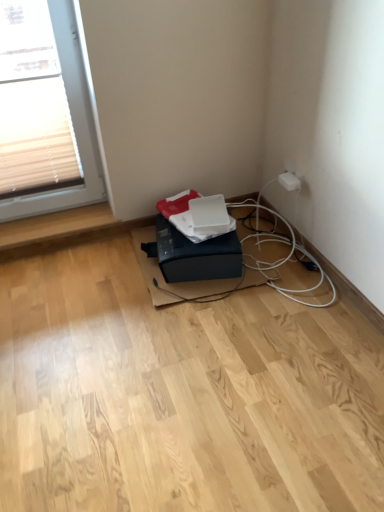
This screenshot has width=384, height=512. Describe the element at coordinates (289, 181) in the screenshot. I see `white plastic electric outlet at upper right` at that location.

Locate an element on the screen. white plastic electric outlet at upper right is located at coordinates (289, 181).

Locate an element on the screen. The width and height of the screenshot is (384, 512). black matte printer at lower center is located at coordinates (196, 255).

Image resolution: width=384 pixels, height=512 pixels. What do you see at coordinates (196, 255) in the screenshot?
I see `black matte printer at lower center` at bounding box center [196, 255].

Locate an element on the screen. The image size is (384, 512). white plastic electric outlet at upper right is located at coordinates (289, 181).

Would you say black matte printer at lower center is to the left or to the right of white plastic electric outlet at upper right in the picture?

Clearly, black matte printer at lower center is on the left of white plastic electric outlet at upper right in the image.

Which is in front, black matte printer at lower center or white plastic electric outlet at upper right?

black matte printer at lower center is more forward.

Which is nearer, (189, 274) or (278, 181)?

Point (189, 274) is closer to the camera than point (278, 181).

From the image's perspective, is black matte printer at lower center on top of white plastic electric outlet at upper right?

Incorrect, from the image's perspective, black matte printer at lower center is lower than white plastic electric outlet at upper right.

From a real-world perspective, is black matte printer at lower center on white plastic electric outlet at upper right?

No.

Does black matte printer at lower center have a lesser width compared to white plastic electric outlet at upper right?

No.

From their relative heights in the image, would you say black matte printer at lower center is taller or shorter than white plastic electric outlet at upper right?

In the image, black matte printer at lower center appears to be taller than white plastic electric outlet at upper right.

Does black matte printer at lower center have a larger size compared to white plastic electric outlet at upper right?

Yes, black matte printer at lower center is bigger than white plastic electric outlet at upper right.

Does black matte printer at lower center contain white plastic electric outlet at upper right?

That's incorrect, white plastic electric outlet at upper right is not inside black matte printer at lower center.

Is black matte printer at lower center not near white plastic electric outlet at upper right?

No, black matte printer at lower center is in close proximity to white plastic electric outlet at upper right.

Does black matte printer at lower center turn towards white plastic electric outlet at upper right?

No, black matte printer at lower center does not turn towards white plastic electric outlet at upper right.

What's the angular difference between black matte printer at lower center and white plastic electric outlet at upper right's facing directions?

There is a 15.6-degree angle between the facing directions of black matte printer at lower center and white plastic electric outlet at upper right.

How much distance is there between black matte printer at lower center and white plastic electric outlet at upper right?

A distance of 21.75 inches exists between black matte printer at lower center and white plastic electric outlet at upper right.

Where is `electric outlet behind the black matte printer at lower center`? The width and height of the screenshot is (384, 512). electric outlet behind the black matte printer at lower center is located at coordinates (289, 181).

Can you confirm if white plastic electric outlet at upper right is positioned to the right of black matte printer at lower center?

Indeed, white plastic electric outlet at upper right is positioned on the right side of black matte printer at lower center.

Consider the image. Does white plastic electric outlet at upper right lie in front of black matte printer at lower center?

No, white plastic electric outlet at upper right is behind black matte printer at lower center.

Is point (278, 178) positioned before point (178, 259)?

That is False.

From the image's perspective, is white plastic electric outlet at upper right positioned above or below black matte printer at lower center?

Clearly, from the image's perspective, white plastic electric outlet at upper right is above black matte printer at lower center.

Consider the image. From a real-world perspective, is white plastic electric outlet at upper right on black matte printer at lower center?

Yes.

Which object is thinner, white plastic electric outlet at upper right or black matte printer at lower center?

With smaller width is white plastic electric outlet at upper right.

From their relative heights in the image, would you say white plastic electric outlet at upper right is taller or shorter than black matte printer at lower center?

Clearly, white plastic electric outlet at upper right is shorter compared to black matte printer at lower center.

Does white plastic electric outlet at upper right have a larger size compared to black matte printer at lower center?

Actually, white plastic electric outlet at upper right might be smaller than black matte printer at lower center.

Is white plastic electric outlet at upper right outside of black matte printer at lower center?

white plastic electric outlet at upper right lies outside black matte printer at lower center's area.

Is the surface of white plastic electric outlet at upper right in direct contact with black matte printer at lower center?

No, white plastic electric outlet at upper right is not beside black matte printer at lower center.

Looking at this image, does white plastic electric outlet at upper right turn towards black matte printer at lower center?

No, white plastic electric outlet at upper right is not turned towards black matte printer at lower center.

Where is `box lying in front of the white plastic electric outlet at upper right`? box lying in front of the white plastic electric outlet at upper right is located at coordinates (196, 255).

Where is `electric outlet behind the black matte printer at lower center`? The image size is (384, 512). electric outlet behind the black matte printer at lower center is located at coordinates (289, 181).

At what (x,y) coordinates should I click in order to perform the action: click on box lying below the white plastic electric outlet at upper right (from the image's perspective). Please return your answer as a coordinate pair (x, y). Looking at the image, I should click on (196, 255).